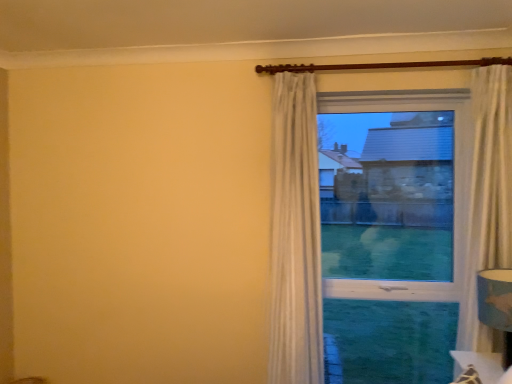
Question: From a real-world perspective, is white textured curtain at upper center positioned above or below transparent glass window at center?

Choices:
 (A) above
 (B) below

Answer: (B)

Question: Is white textured curtain at upper center wider or thinner than transparent glass window at center?

Choices:
 (A) wide
 (B) thin

Answer: (A)

Question: Considering the real-world distances, which object is closest to the white textured curtain at upper center?

Choices:
 (A) transparent glass window at center
 (B) blue fabric lampshade at lower right

Answer: (A)

Question: Estimate the real-world distances between objects in this image. Which object is farther from the white textured curtain at upper center?

Choices:
 (A) transparent glass window at center
 (B) blue fabric lampshade at lower right

Answer: (B)